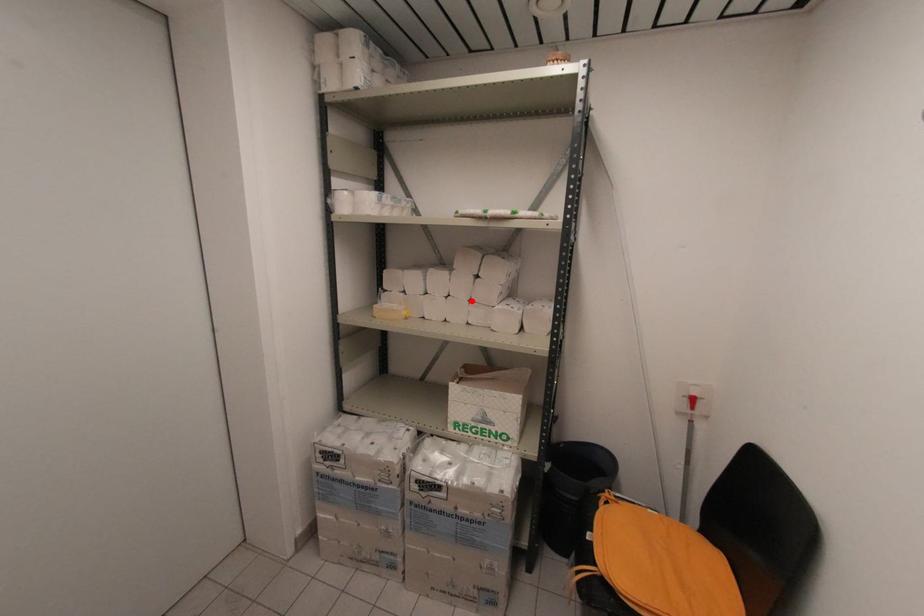
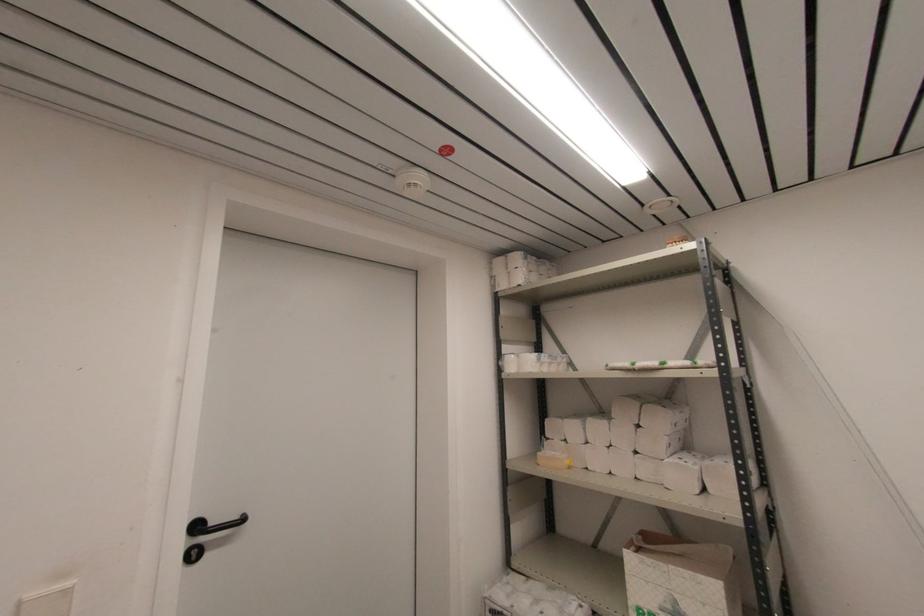
The point at the highlighted location is marked in the first image. Where is the corresponding point in the second image?

(637, 453)